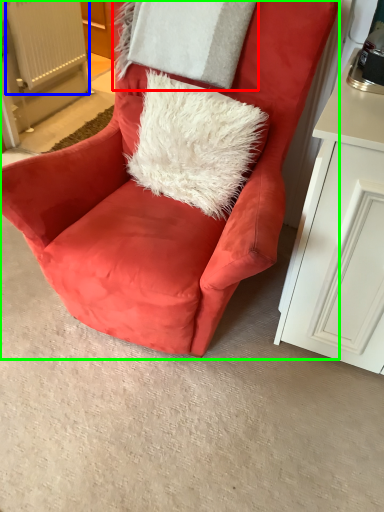
Question: Which object is positioned closest to pillow (highlighted by a red box)? Select from radiator (highlighted by a blue box) and chair (highlighted by a green box).

Choices:
 (A) radiator
 (B) chair

Answer: (B)